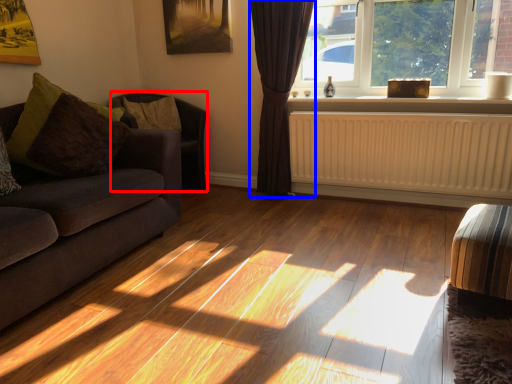
Question: Which of the following is the farthest to the observer, armchair (highlighted by a red box) or curtain (highlighted by a blue box)?

Choices:
 (A) armchair
 (B) curtain

Answer: (A)